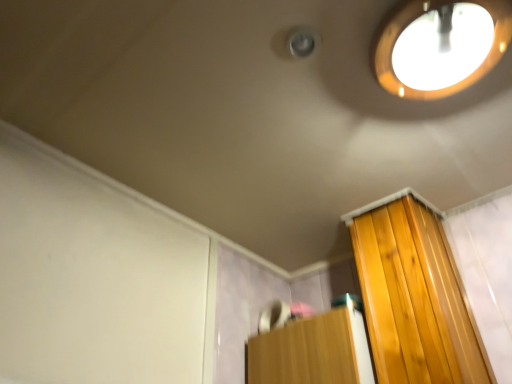
Find the location of `matte wooden droplight at upper right`. matte wooden droplight at upper right is located at coordinates (442, 45).

Where is `matte wooden droplight at upper right`? matte wooden droplight at upper right is located at coordinates (442, 45).

Is white matte screen door at upper left wider or thinner than wooden cabinet at lower right?

In the image, white matte screen door at upper left appears to be more narrow than wooden cabinet at lower right.

From the image's perspective, is white matte screen door at upper left located above or below wooden cabinet at lower right?

Based on their image positions, white matte screen door at upper left is located above wooden cabinet at lower right.

Find the location of a particular element. screen door that is in front of the wooden cabinet at lower right is located at coordinates (94, 277).

Which object is positioned more to the left, white matte screen door at upper left or wooden cabinet at lower right?

white matte screen door at upper left.

Considering the positions of points (466, 68) and (57, 323), is point (466, 68) closer to camera compared to point (57, 323)?

That is True.

Considering the relative sizes of matte wooden droplight at upper right and white matte screen door at upper left in the image provided, is matte wooden droplight at upper right wider than white matte screen door at upper left?

Correct, the width of matte wooden droplight at upper right exceeds that of white matte screen door at upper left.

Can we say matte wooden droplight at upper right lies outside white matte screen door at upper left?

Yes.

Is matte wooden droplight at upper right aimed at white matte screen door at upper left?

No, matte wooden droplight at upper right is not turned towards white matte screen door at upper left.

Is wooden cabinet at lower right positioned beyond the bounds of matte wooden droplight at upper right?

wooden cabinet at lower right lies outside matte wooden droplight at upper right's area.

Is the surface of wooden cabinet at lower right in direct contact with matte wooden droplight at upper right?

They are not placed beside each other.

Is white matte screen door at upper left aimed at matte wooden droplight at upper right?

Yes, white matte screen door at upper left faces towards matte wooden droplight at upper right.

Considering the sizes of white matte screen door at upper left and matte wooden droplight at upper right in the image, is white matte screen door at upper left wider or thinner than matte wooden droplight at upper right?

In the image, white matte screen door at upper left appears to be more narrow than matte wooden droplight at upper right.

Who is bigger, white matte screen door at upper left or matte wooden droplight at upper right?

With larger size is white matte screen door at upper left.

Considering the sizes of white matte screen door at upper left and matte wooden droplight at upper right in the image, is white matte screen door at upper left taller or shorter than matte wooden droplight at upper right?

In the image, white matte screen door at upper left appears to be taller than matte wooden droplight at upper right.

How different are the orientations of wooden cabinet at lower right and white matte screen door at upper left in degrees?

They differ by 89.7 degrees in their facing directions.

Is wooden cabinet at lower right bigger or smaller than white matte screen door at upper left?

wooden cabinet at lower right is bigger than white matte screen door at upper left.

Which point is more distant from viewer, (334, 375) or (112, 334)?

The point (334, 375) is farther from the camera.

Looking at their sizes, would you say wooden cabinet at lower right is wider or thinner than white matte screen door at upper left?

wooden cabinet at lower right is wider than white matte screen door at upper left.

From a real-world perspective, relative to wooden cabinet at lower right, is matte wooden droplight at upper right vertically above or below?

From a real-world perspective, matte wooden droplight at upper right is physically above wooden cabinet at lower right.

Does matte wooden droplight at upper right have a lesser width compared to wooden cabinet at lower right?

Yes.

From the image's perspective, is matte wooden droplight at upper right below wooden cabinet at lower right?

No, from the image's perspective, matte wooden droplight at upper right is not below wooden cabinet at lower right.

Measure the distance between matte wooden droplight at upper right and wooden cabinet at lower right.

matte wooden droplight at upper right is 30.78 inches away from wooden cabinet at lower right.

Locate an element on the screen. furniture below the white matte screen door at upper left (from the image's perspective) is located at coordinates (312, 351).

Where is `droplight above the white matte screen door at upper left (from the image's perspective)`? Image resolution: width=512 pixels, height=384 pixels. droplight above the white matte screen door at upper left (from the image's perspective) is located at coordinates (442, 45).

Which object lies nearer to the anchor point white matte screen door at upper left, wooden cabinet at lower right or matte wooden droplight at upper right?

wooden cabinet at lower right lies closer to white matte screen door at upper left than the other object.

Which object lies nearer to the anchor point wooden cabinet at lower right, matte wooden droplight at upper right or white matte screen door at upper left?

The object closer to wooden cabinet at lower right is white matte screen door at upper left.

Based on their spatial positions, is wooden cabinet at lower right or white matte screen door at upper left further from matte wooden droplight at upper right?

white matte screen door at upper left lies further to matte wooden droplight at upper right than the other object.

Which object lies nearer to the anchor point matte wooden droplight at upper right, white matte screen door at upper left or wooden cabinet at lower right?

wooden cabinet at lower right is closer to matte wooden droplight at upper right.

From the image, which object appears to be farther from white matte screen door at upper left, matte wooden droplight at upper right or wooden cabinet at lower right?

The object further to white matte screen door at upper left is matte wooden droplight at upper right.

Based on their spatial positions, is white matte screen door at upper left or matte wooden droplight at upper right closer to wooden cabinet at lower right?

white matte screen door at upper left is closer to wooden cabinet at lower right.

You are a GUI agent. You are given a task and a screenshot of the screen. Output one action in this format:
    pyautogui.click(x=<x>, y=<y>)
    Task: Click on the screen door between matte wooden droplight at upper right and wooden cabinet at lower right in the vertical direction
    The width and height of the screenshot is (512, 384).
    Given the screenshot: What is the action you would take?
    pyautogui.click(x=94, y=277)